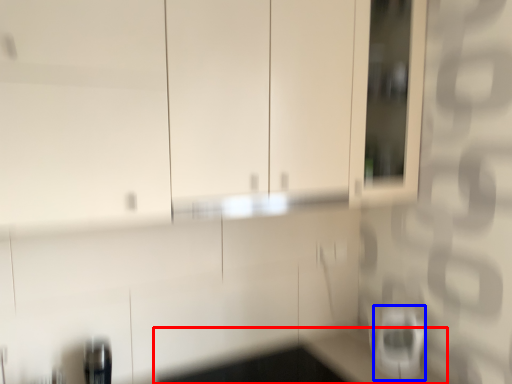
Question: Which point is closer to the camera, counter top (highlighted by a red box) or appliance (highlighted by a blue box)?

Choices:
 (A) counter top
 (B) appliance

Answer: (A)